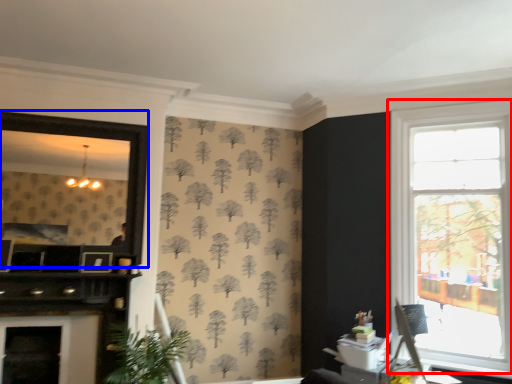
Question: Which object appears closest to the camera in this image, window (highlighted by a red box) or window screen (highlighted by a blue box)?

Choices:
 (A) window
 (B) window screen

Answer: (A)